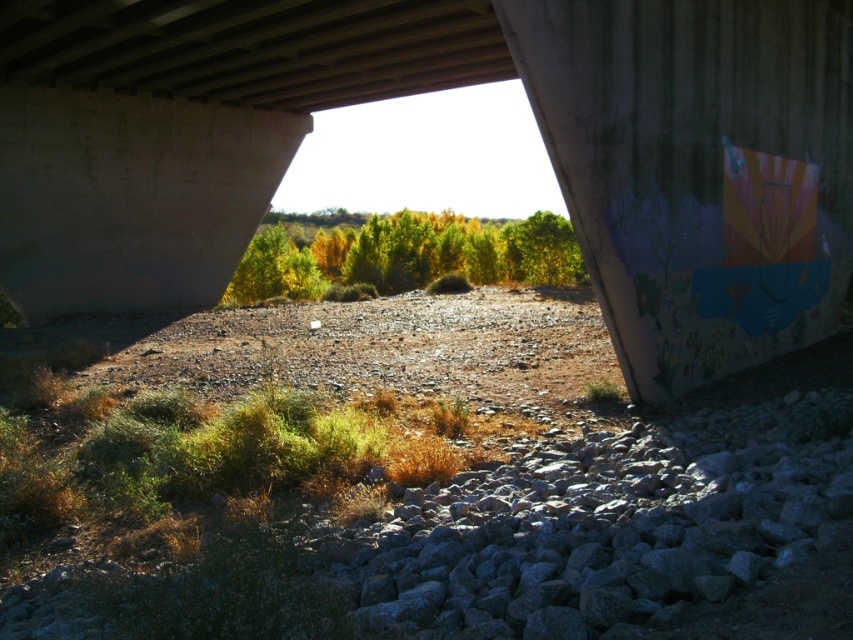
Question: Is concrete at center below green matte trees at center?

Choices:
 (A) no
 (B) yes

Answer: (B)

Question: Which point appears farthest from the camera in this image?

Choices:
 (A) (x=296, y=284)
 (B) (x=372, y=51)

Answer: (A)

Question: Is concrete at center positioned at the back of green matte trees at center?

Choices:
 (A) yes
 (B) no

Answer: (B)

Question: Can you confirm if concrete at center is smaller than green matte trees at center?

Choices:
 (A) yes
 (B) no

Answer: (B)

Question: Which of the following is the farthest from the observer?

Choices:
 (A) concrete at center
 (B) green matte trees at center

Answer: (B)